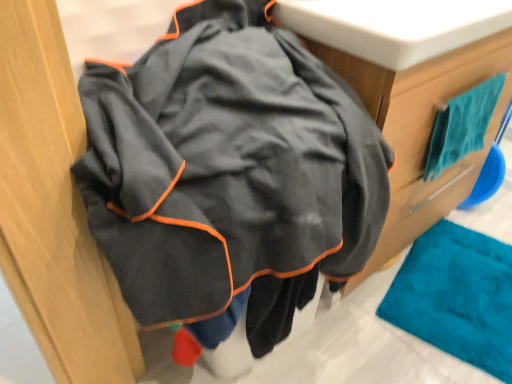
I want to click on teal fabric towel at upper right, so click(410, 88).

Measure the distance between teal fabric towel at upper right and camera.

The depth of teal fabric towel at upper right is 30.33 inches.

This screenshot has width=512, height=384. What do you see at coordinates (410, 88) in the screenshot? I see `teal fabric towel at upper right` at bounding box center [410, 88].

Identify the location of teal fabric towel at upper right. Image resolution: width=512 pixels, height=384 pixels. (462, 125).

Image resolution: width=512 pixels, height=384 pixels. Describe the element at coordinates (462, 125) in the screenshot. I see `teal fabric towel at upper right` at that location.

The height and width of the screenshot is (384, 512). In order to click on teal fabric towel at upper right in this screenshot , I will do `click(410, 88)`.

Considering the positions of objects teal fabric towel at upper right and teal fabric towel at upper right in the image provided, who is more to the left, teal fabric towel at upper right or teal fabric towel at upper right?

teal fabric towel at upper right is more to the left.

Between teal fabric towel at upper right and teal fabric towel at upper right, which one is positioned in front?

teal fabric towel at upper right is more forward.

Does point (472, 95) come behind point (467, 36)?

Yes.

From the image's perspective, relative to teal fabric towel at upper right, is teal fabric towel at upper right above or below?

Clearly, from the image's perspective, teal fabric towel at upper right is above teal fabric towel at upper right.

Looking at this image, from a real-world perspective, is teal fabric towel at upper right positioned over teal fabric towel at upper right based on gravity?

Correct, in the physical world, teal fabric towel at upper right is higher than teal fabric towel at upper right.

Considering the sizes of objects teal fabric towel at upper right and teal fabric towel at upper right in the image provided, who is thinner, teal fabric towel at upper right or teal fabric towel at upper right?

teal fabric towel at upper right.

Considering the relative sizes of teal fabric towel at upper right and teal fabric towel at upper right in the image provided, is teal fabric towel at upper right taller than teal fabric towel at upper right?

No.

Considering the relative sizes of teal fabric towel at upper right and teal fabric towel at upper right in the image provided, is teal fabric towel at upper right smaller than teal fabric towel at upper right?

Yes.

Do you think teal fabric towel at upper right is within teal fabric towel at upper right, or outside of it?

The correct answer is: outside.

Is teal fabric towel at upper right far from teal fabric towel at upper right?

Actually, teal fabric towel at upper right and teal fabric towel at upper right are a little close together.

Could you tell me if teal fabric towel at upper right is facing teal fabric towel at upper right?

No, teal fabric towel at upper right does not turn towards teal fabric towel at upper right.

Locate an element on the screen. This screenshot has width=512, height=384. bath towel that appears on the right of teal fabric towel at upper right is located at coordinates (462, 125).

In the scene shown: Considering the relative positions of teal fabric towel at upper right and teal fabric towel at upper right in the image provided, is teal fabric towel at upper right to the left of teal fabric towel at upper right from the viewer's perspective?

Yes.

Is teal fabric towel at upper right further to the viewer compared to teal fabric towel at upper right?

That is False.

Which is farther from the camera, (470, 87) or (473, 96)?

The point (470, 87) is more distant.

From the image's perspective, would you say teal fabric towel at upper right is positioned over teal fabric towel at upper right?

Actually, teal fabric towel at upper right appears below teal fabric towel at upper right in the image.

From a real-world perspective, which object rests below the other?

teal fabric towel at upper right is physically lower.

Between teal fabric towel at upper right and teal fabric towel at upper right, which one has smaller width?

With smaller width is teal fabric towel at upper right.

Can you confirm if teal fabric towel at upper right is shorter than teal fabric towel at upper right?

Incorrect, the height of teal fabric towel at upper right does not fall short of that of teal fabric towel at upper right.

Looking at the image, does teal fabric towel at upper right seem bigger or smaller compared to teal fabric towel at upper right?

Considering their sizes, teal fabric towel at upper right takes up more space than teal fabric towel at upper right.

Is teal fabric towel at upper right inside teal fabric towel at upper right?

No, teal fabric towel at upper right is not surrounded by teal fabric towel at upper right.

Is teal fabric towel at upper right far from teal fabric towel at upper right?

No, teal fabric towel at upper right is in close proximity to teal fabric towel at upper right.

Is teal fabric towel at upper right oriented away from teal fabric towel at upper right?

Correct, teal fabric towel at upper right is looking away from teal fabric towel at upper right.

What's the angular difference between teal fabric towel at upper right and teal fabric towel at upper right's facing directions?

The facing directions of teal fabric towel at upper right and teal fabric towel at upper right are 0.48 degrees apart.

Locate an element on the screen. bath towel on the right side of teal fabric towel at upper right is located at coordinates (462, 125).

The height and width of the screenshot is (384, 512). Find the location of `furniture below the teal fabric towel at upper right (from a real-world perspective)`. furniture below the teal fabric towel at upper right (from a real-world perspective) is located at coordinates (410, 88).

Find the location of a particular element. furniture in front of the teal fabric towel at upper right is located at coordinates (410, 88).